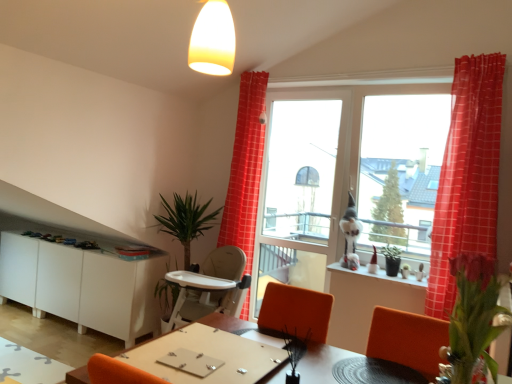
Describe the element at coordinates (294, 352) in the screenshot. I see `green matte plant at lower center, acting as the first plant starting from the back` at that location.

Identify the location of red checkered curtain at right, which is the 1th curtain from right to left. (467, 176).

Locate an element on the screen. The image size is (512, 384). transparent glass window at upper right is located at coordinates (401, 169).

What do you see at coordinates (186, 221) in the screenshot? The width and height of the screenshot is (512, 384). I see `green leafy plant at left` at bounding box center [186, 221].

What is the approximate height of white glossy window sill at lower right?

white glossy window sill at lower right is 1.71 inches in height.

Describe the element at coordinates (381, 275) in the screenshot. This screenshot has height=384, width=512. I see `white glossy window sill at lower right` at that location.

What do you see at coordinates (474, 315) in the screenshot? I see `pink matte flower at right, placed as the second plant when sorted from left to right` at bounding box center [474, 315].

This screenshot has width=512, height=384. In order to click on wooden table at center, which is the second table from left to right in this screenshot , I will do `click(225, 322)`.

From a real-world perspective, which object rests below the other?

wooden table at lower left, positioned as the second table in top-to-bottom order, from a real-world perspective.

Is wooden table at lower left, positioned as the second table in top-to-bottom order, thinner than white matte cabinet at lower left?

Result: Incorrect, the width of wooden table at lower left, positioned as the second table in top-to-bottom order, is not less than that of white matte cabinet at lower left.

Can you confirm if wooden table at lower left, positioned as the 1th table in bottom-to-top order, is shorter than white matte cabinet at lower left?

Yes.

Is pink matte flower at right, positioned as the 2th plant in back-to-front order, oriented towards red checkered curtain at upper center, which is the 2th curtain in right-to-left order?

No, pink matte flower at right, positioned as the 2th plant in back-to-front order, does not turn towards red checkered curtain at upper center, which is the 2th curtain in right-to-left order.

Is point (485, 348) more distant than point (249, 137)?

No, it is not.

From the image's perspective, is pink matte flower at right, which appears as the first plant when viewed from the right, positioned above or below red checkered curtain at upper center, which is the 2th curtain in right-to-left order?

From the image's perspective, pink matte flower at right, which appears as the first plant when viewed from the right, appears below red checkered curtain at upper center, which is the 2th curtain in right-to-left order.

Does pink matte flower at right, which is counted as the 1th plant, starting from the front, have a greater width compared to red checkered curtain at upper center, the first curtain when ordered from back to front?

Incorrect, the width of pink matte flower at right, which is counted as the 1th plant, starting from the front, does not surpass that of red checkered curtain at upper center, the first curtain when ordered from back to front.

Which of these two, transparent glass window at upper right or wooden table at lower left, the 2th table from the front, stands shorter?

With less height is wooden table at lower left, the 2th table from the front.

From a real-world perspective, is transparent glass window at upper right located higher than wooden table at lower left, which is the 2th table from right to left?

Yes, from a real-world perspective, transparent glass window at upper right is over wooden table at lower left, which is the 2th table from right to left

Considering the sizes of objects transparent glass window at upper right and wooden table at lower left, which is the 2th table from right to left, in the image provided, who is wider, transparent glass window at upper right or wooden table at lower left, which is the 2th table from right to left,?

Wider between the two is wooden table at lower left, which is the 2th table from right to left.

Considering the sizes of objects red checkered curtain at upper center, which is the 2th curtain in right-to-left order, and red checkered curtain at right, arranged as the second curtain when viewed from the back, in the image provided, who is bigger, red checkered curtain at upper center, which is the 2th curtain in right-to-left order, or red checkered curtain at right, arranged as the second curtain when viewed from the back,?

red checkered curtain at upper center, which is the 2th curtain in right-to-left order, is bigger.

Are red checkered curtain at upper center, the first curtain when ordered from back to front, and red checkered curtain at right, the first curtain when ordered from front to back, far apart?

Indeed, red checkered curtain at upper center, the first curtain when ordered from back to front, is not near red checkered curtain at right, the first curtain when ordered from front to back.

Locate an element on the screen. curtain that appears below the red checkered curtain at right, which appears as the 2th curtain when viewed from the left (from the image's perspective) is located at coordinates (245, 168).

Considering the relative positions of red checkered curtain at upper center, the first curtain when ordered from back to front, and red checkered curtain at right, which is the 1th curtain from right to left, in the image provided, is red checkered curtain at upper center, the first curtain when ordered from back to front, behind red checkered curtain at right, which is the 1th curtain from right to left,?

Yes, red checkered curtain at upper center, the first curtain when ordered from back to front, is further from the camera.

From a real-world perspective, is transparent glass window at upper right under pink matte flower at right, which appears as the first plant when viewed from the right?

No, from a real-world perspective, transparent glass window at upper right is not under pink matte flower at right, which appears as the first plant when viewed from the right.

Would you consider transparent glass window at upper right to be distant from pink matte flower at right, which is counted as the 1th plant, starting from the front?

transparent glass window at upper right is far away from pink matte flower at right, which is counted as the 1th plant, starting from the front.

Is transparent glass window at upper right facing away from pink matte flower at right, placed as the second plant when sorted from left to right?

No, transparent glass window at upper right's orientation is not away from pink matte flower at right, placed as the second plant when sorted from left to right.

Between point (407, 171) and point (494, 281), which one is positioned in front?

The point (494, 281) is closer to the camera.

Is white matte cabinet at lower left not within white glossy window sill at lower right?

Yes, white matte cabinet at lower left is outside of white glossy window sill at lower right.

At what (x,y) coordinates should I click in order to perform the action: click on window sill lying on the right of white matte cabinet at lower left. Please return your answer as a coordinate pair (x, y). This screenshot has width=512, height=384. Looking at the image, I should click on (381, 275).

Is white matte cabinet at lower left shorter than white glossy window sill at lower right?

No, white matte cabinet at lower left is not shorter than white glossy window sill at lower right.

From the image's perspective, which one is positioned lower, red checkered curtain at right, which appears as the 2th curtain when viewed from the left, or green leafy plant at left?

green leafy plant at left, from the image's perspective.

Can you confirm if red checkered curtain at right, arranged as the second curtain when viewed from the back, is thinner than green leafy plant at left?

Indeed, red checkered curtain at right, arranged as the second curtain when viewed from the back, has a lesser width compared to green leafy plant at left.

Is red checkered curtain at right, which appears as the 2th curtain when viewed from the left, to the left or to the right of green leafy plant at left in the image?

red checkered curtain at right, which appears as the 2th curtain when viewed from the left, is positioned on green leafy plant at left's right side.

Consider the image. Choose the correct answer: Is red checkered curtain at right, arranged as the second curtain when viewed from the back, inside green leafy plant at left or outside it?

red checkered curtain at right, arranged as the second curtain when viewed from the back, cannot be found inside green leafy plant at left.

From the image's perspective, which table is the 2nd one below the white matte cabinet at lower left? Please provide its 2D coordinates.

[(29, 365)]

Locate an element on the screen. Image resolution: width=512 pixels, height=384 pixels. curtain that is the 1st object above the pink matte flower at right, positioned as the 2th plant in back-to-front order (from a real-world perspective) is located at coordinates (245, 168).

Which object lies nearer to the anchor point transparent glass window at upper right, green matte plant at lower center, which is counted as the first plant, starting from the left, or wooden table at lower left, the 2th table from the front?

Among the two, green matte plant at lower center, which is counted as the first plant, starting from the left, is located nearer to transparent glass window at upper right.

Estimate the real-world distances between objects in this image. Which object is closer to wooden table at lower left, which is the 1th table in left-to-right order, wooden table at center, which is the 1th table in front-to-back order, or green matte plant at lower center, which is the 2th plant in front-to-back order?

wooden table at center, which is the 1th table in front-to-back order, is positioned closer to the anchor wooden table at lower left, which is the 1th table in left-to-right order.

Estimate the real-world distances between objects in this image. Which object is closer to transparent glass screen door at center, transparent glass window at upper right or green matte plant at lower center, acting as the first plant starting from the back?

transparent glass window at upper right.

Estimate the real-world distances between objects in this image. Which object is closer to transparent glass window at upper right, red checkered curtain at upper center, acting as the 2th curtain starting from the front, or green leafy plant at left?

The object closer to transparent glass window at upper right is red checkered curtain at upper center, acting as the 2th curtain starting from the front.

Estimate the real-world distances between objects in this image. Which object is further from transparent glass screen door at center, pink matte flower at right, which is counted as the 1th plant, starting from the front, or wooden table at lower left, which is the 2th table from right to left?

Among the two, pink matte flower at right, which is counted as the 1th plant, starting from the front, is located further to transparent glass screen door at center.

When comparing their distances from wooden table at lower left, which is the 1th table in left-to-right order, does green matte plant at lower center, which is the 2th plant in front-to-back order, or wooden table at center, the 1th table when ordered from top to bottom, seem further?

The object further to wooden table at lower left, which is the 1th table in left-to-right order, is green matte plant at lower center, which is the 2th plant in front-to-back order.

Looking at the image, which one is located closer to pink matte flower at right, which is counted as the 1th plant, starting from the front, white glossy window sill at lower right or red checkered curtain at right, which is the 1th curtain from right to left?

red checkered curtain at right, which is the 1th curtain from right to left, is closer to pink matte flower at right, which is counted as the 1th plant, starting from the front.

Which object lies nearer to the anchor point green matte plant at lower center, which is counted as the first plant, starting from the left, white matte cabinet at lower left or red checkered curtain at upper center, the first curtain when ordered from back to front?

red checkered curtain at upper center, the first curtain when ordered from back to front, is positioned closer to the anchor green matte plant at lower center, which is counted as the first plant, starting from the left.

I want to click on cabinetry between wooden table at lower left, positioned as the 1th table in bottom-to-top order, and red checkered curtain at right, which is the 1th curtain from right to left, so click(x=82, y=286).

I want to click on houseplant located between wooden table at lower left, which is the 1th table in back-to-front order, and transparent glass window at upper right in the left-right direction, so click(186, 221).

You are a GUI agent. You are given a task and a screenshot of the screen. Output one action in this format:
    pyautogui.click(x=<x>, y=<y>)
    Task: Click on the plant situated between wooden table at lower left, positioned as the second table in top-to-bottom order, and transparent glass screen door at center from left to right
    
    Given the screenshot: What is the action you would take?
    pyautogui.click(x=294, y=352)

I want to click on houseplant located between pink matte flower at right, which is counted as the 1th plant, starting from the front, and transparent glass screen door at center in the depth direction, so click(186, 221).